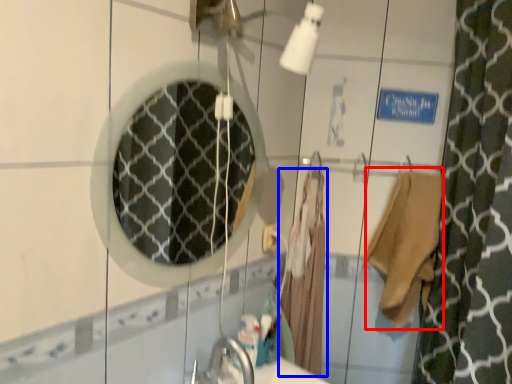
Question: Among these objects, which one is farthest to the camera, robe (highlighted by a red box) or bathrobe (highlighted by a blue box)?

Choices:
 (A) robe
 (B) bathrobe

Answer: (B)